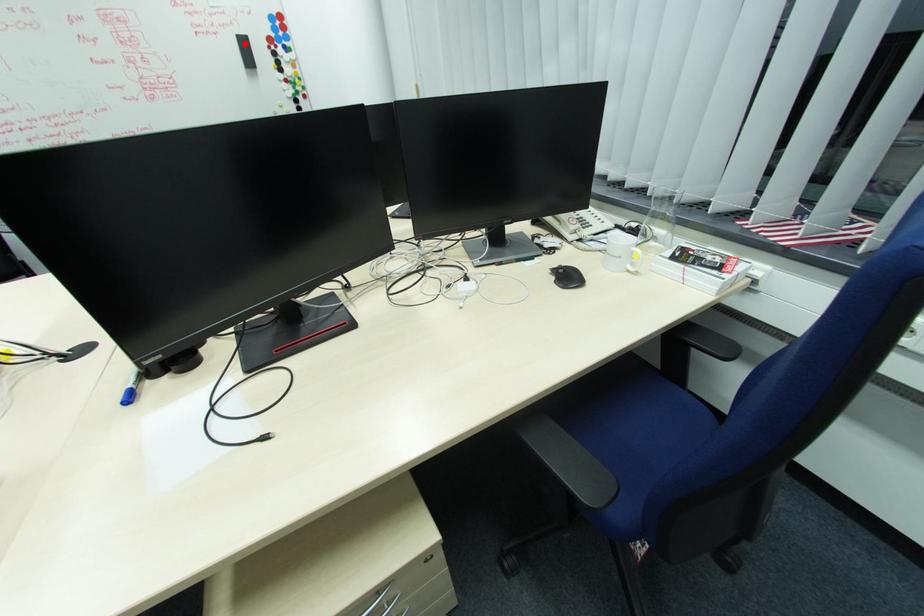
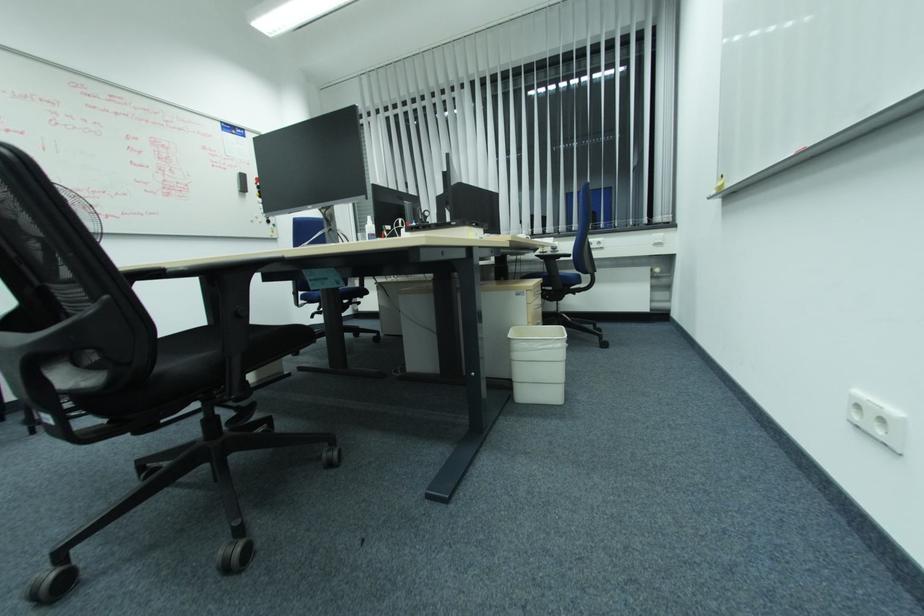
In the second image, find the point that corresponds to the highlighted location in the first image.

(244, 177)